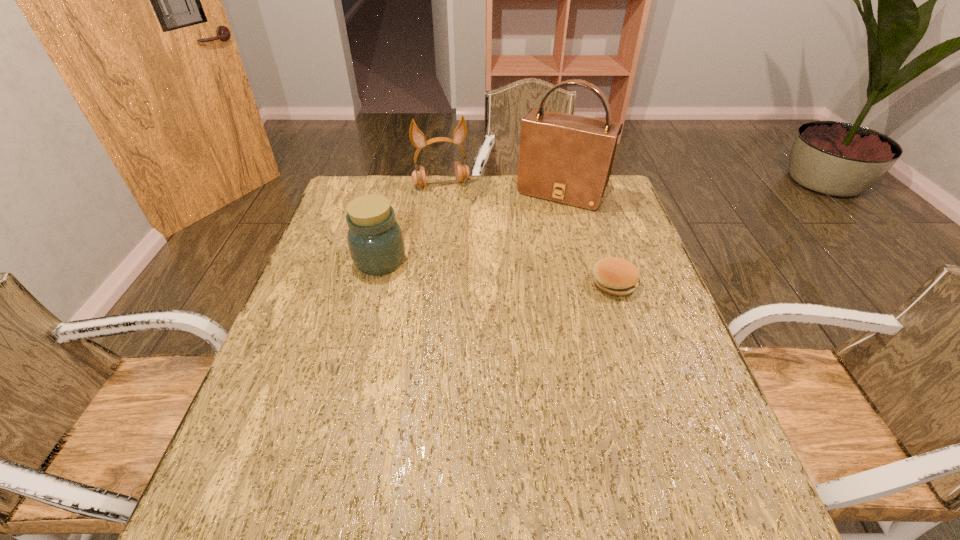
Find the location of a particular element. free space between the tallest object and the second tallest object is located at coordinates (501, 188).

Where is `free spot between the shortest object and the earphone`? This screenshot has width=960, height=540. free spot between the shortest object and the earphone is located at coordinates (528, 234).

Find the location of a particular element. This screenshot has width=960, height=540. the closest object to the second shortest object is located at coordinates (417, 138).

Identify which object is located as the second nearest to the shortest object. Please provide its 2D coordinates. Your answer should be formatted as a tuple, i.e. [(x, y)], where the tuple contains the x and y coordinates of a point satisfying the conditions above.

[(375, 240)]

Image resolution: width=960 pixels, height=540 pixels. I want to click on free point that satisfies the following two spatial constraints: 1. on the front side of the second tallest object; 2. on the right side of the shortest object, so click(430, 283).